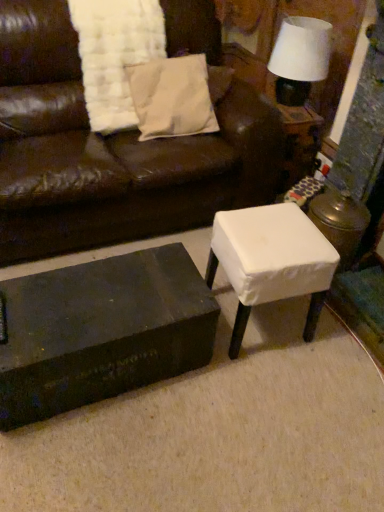
Where is `free space underneath white fabric stool at center (from a real-world perspective)`? free space underneath white fabric stool at center (from a real-world perspective) is located at coordinates (259, 323).